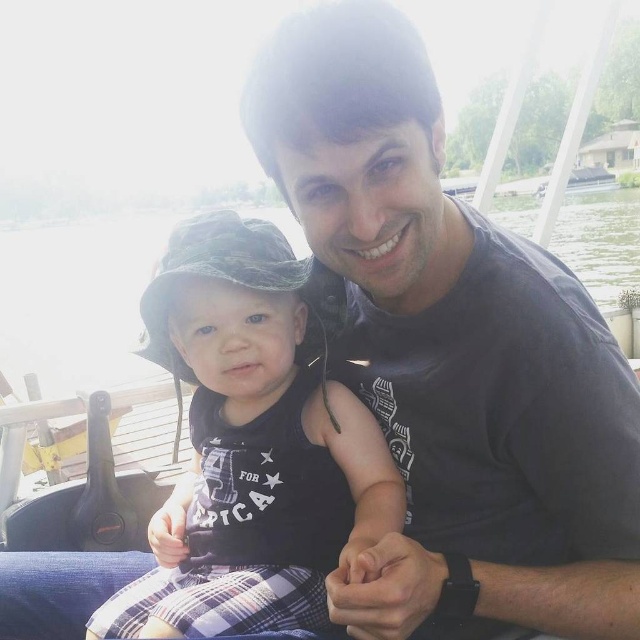
You are a photographer trying to capture a wide shot of the scene. The camouflage fabric hat at left and transparent water at center are both in your frame. Considering their sizes, which object would require you to zoom in more to include its details?

The camouflage fabric hat at left has a smaller width than the transparent water at center, so you would need to zoom in more to capture details of the camouflage fabric hat at left since it is smaller.

You are a photographer trying to capture the reflection of the camouflage fabric hat at left in the transparent water at center. Based on the scene, can you see the hat reflected in the water?

The camouflage fabric hat at left is positioned under transparent water at center, so its reflection would appear in the water above it. Since the water is transparent, you can see the reflection of the camouflage fabric hat at left in the transparent water at center.